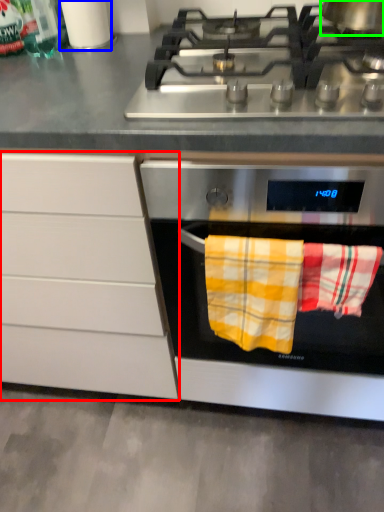
Question: Based on their relative distances, which object is nearer to cabinetry (highlighted by a red box)? Choose from appliance (highlighted by a blue box) and kitchen appliance (highlighted by a green box).

Choices:
 (A) appliance
 (B) kitchen appliance

Answer: (A)